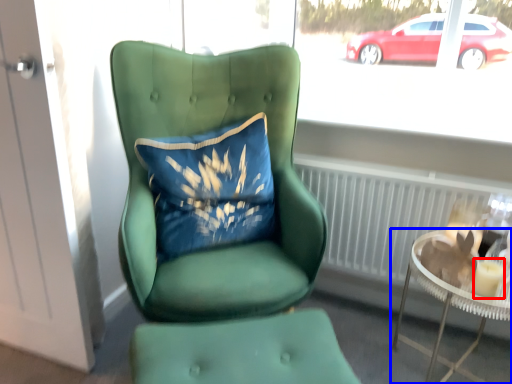
Question: Which of the following is the closest to the observer, candle holder (highlighted by a red box) or table (highlighted by a blue box)?

Choices:
 (A) candle holder
 (B) table

Answer: (B)